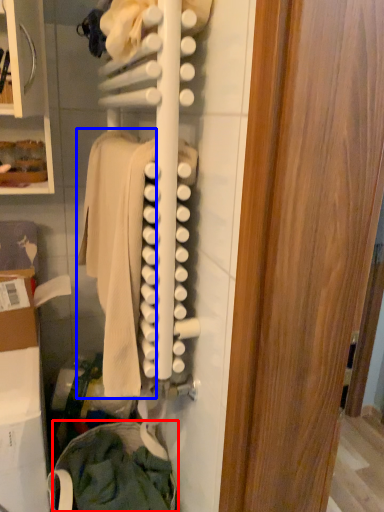
Question: Which object is closer to the camera taking this photo, clothing (highlighted by a red box) or clothing (highlighted by a blue box)?

Choices:
 (A) clothing
 (B) clothing

Answer: (B)